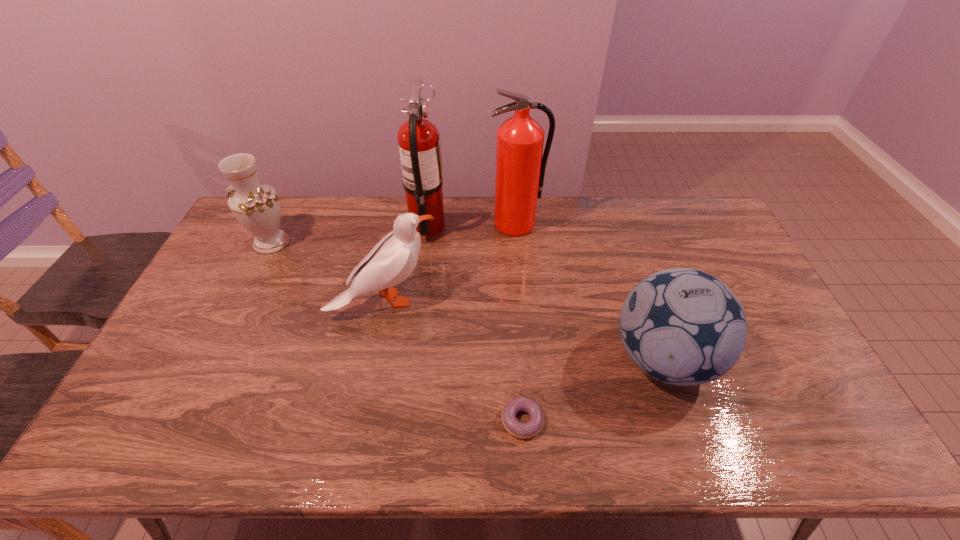
Where is `free space located on the side with brand of the rightmost object`? This screenshot has height=540, width=960. free space located on the side with brand of the rightmost object is located at coordinates (464, 359).

The width and height of the screenshot is (960, 540). I want to click on free space located 0.280m on the side with brand of the rightmost object, so click(x=508, y=359).

Locate an element on the screen. The image size is (960, 540). free region located 0.280m on the side with brand of the rightmost object is located at coordinates (508, 359).

This screenshot has width=960, height=540. I want to click on vacant space located 0.160m on the right of the doughnut, so click(609, 421).

Locate an element on the screen. The height and width of the screenshot is (540, 960). vase that is at the far edge is located at coordinates (256, 206).

What are the coordinates of `object located in the near edge section of the desktop` in the screenshot? It's located at (530, 429).

Image resolution: width=960 pixels, height=540 pixels. Identify the location of object at the left edge. (256, 206).

The image size is (960, 540). In order to click on object that is at the far left corner in this screenshot , I will do `click(256, 206)`.

Identify the location of vacant space at the far edge. (488, 213).

Where is `free space at the near edge of the desktop`? Image resolution: width=960 pixels, height=540 pixels. free space at the near edge of the desktop is located at coordinates (684, 451).